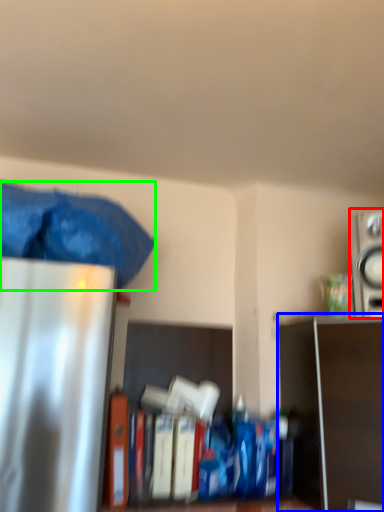
Question: Estimate the real-world distances between objects in this image. Which object is farther from appliance (highlighted by a red box), shelf (highlighted by a blue box) or waste (highlighted by a green box)?

Choices:
 (A) shelf
 (B) waste

Answer: (B)